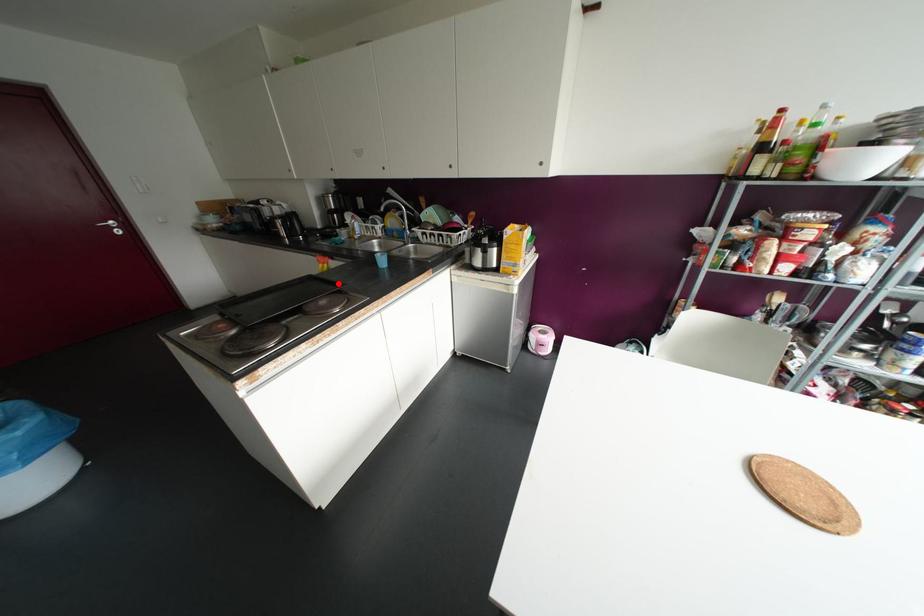
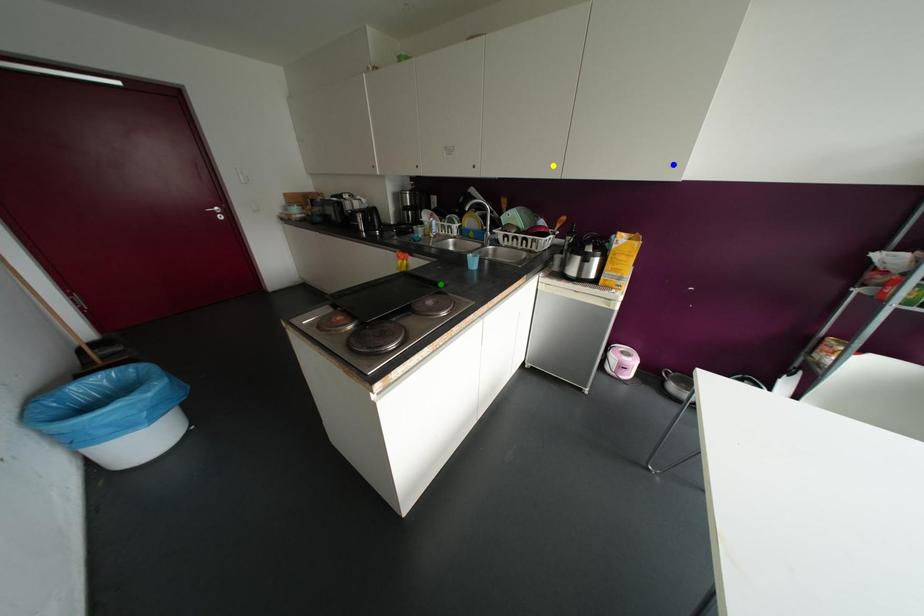
Question: I am providing you with two images of the same scene from different viewpoints. A red point is marked on the first image. You are given multiple points on the second image. In image 2, which mark is for the same physical point as the one in image 1?

Choices:
 (A) yellow point
 (B) blue point
 (C) green point

Answer: (C)